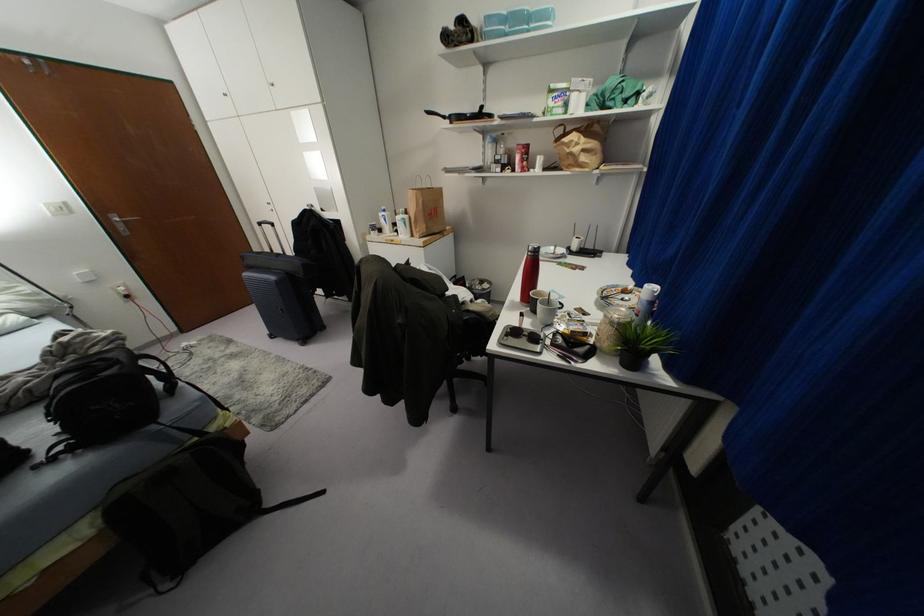
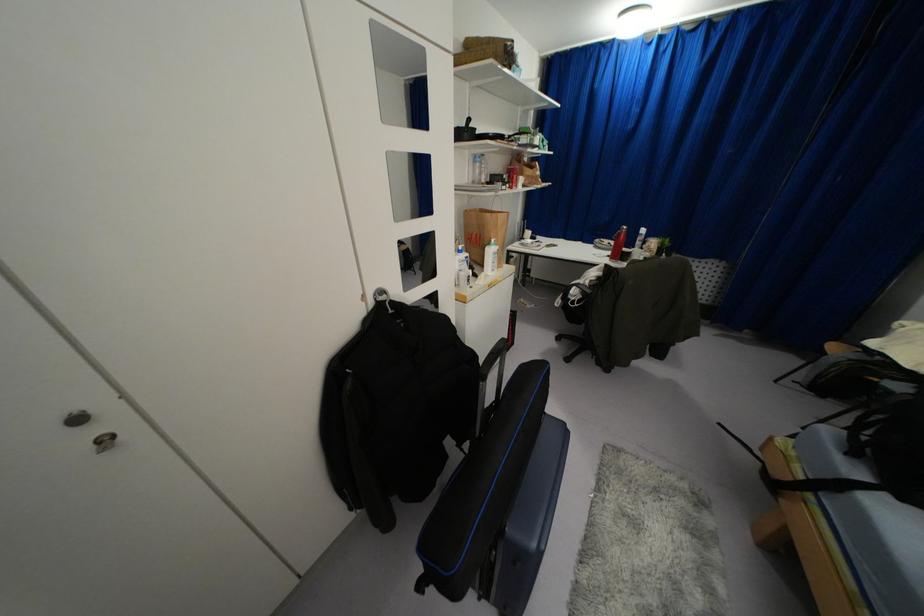
Where in the second image is the point corresponding to the point at 405,216 from the first image?

(495, 246)